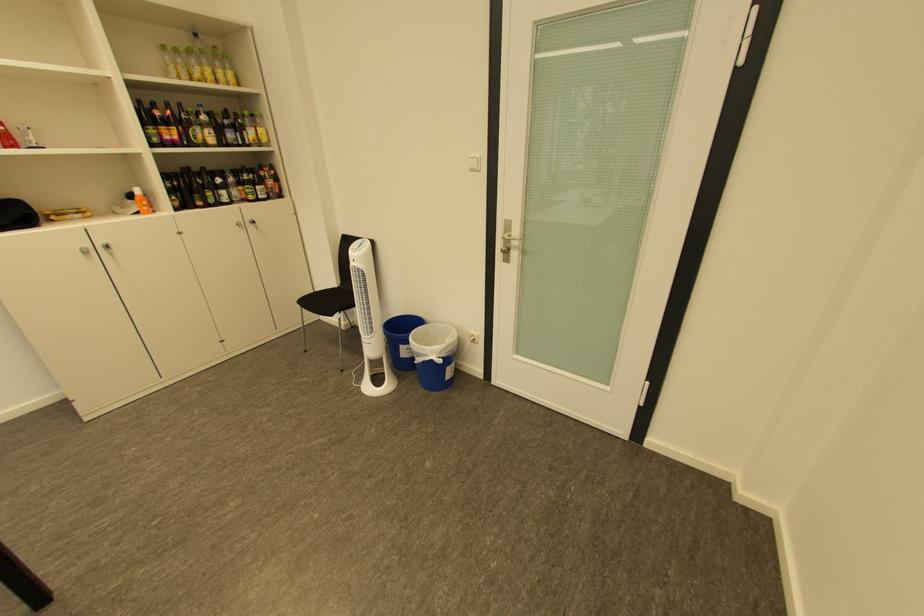
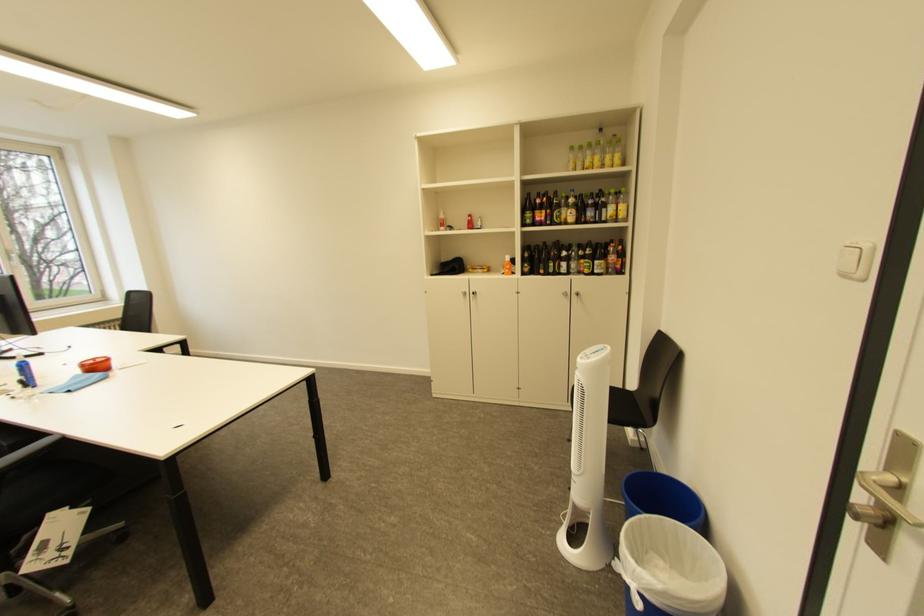
Find the pixel in the second image that matches pixel 219 195 in the first image.

(562, 265)